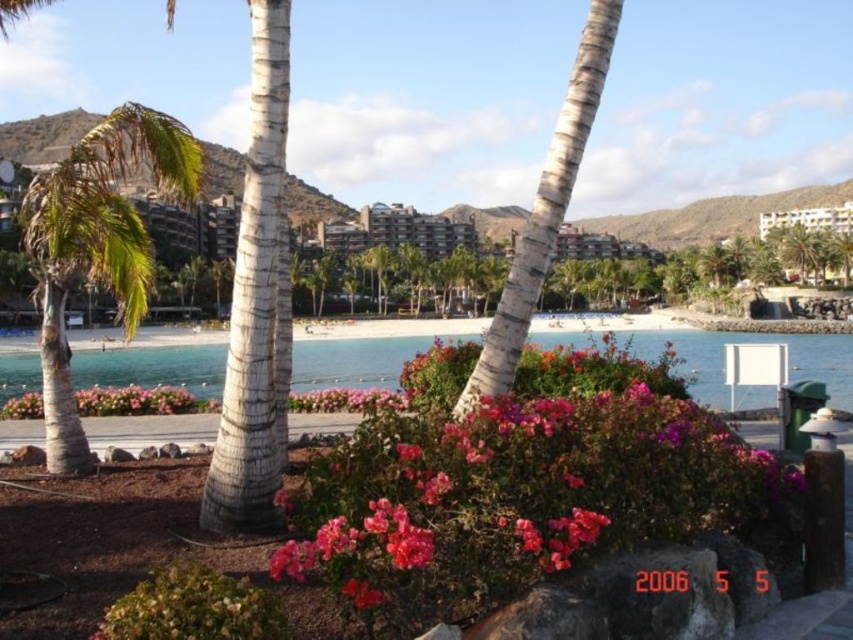
Question: Is white concrete building at upper right in front of pink matte flower at center?

Choices:
 (A) yes
 (B) no

Answer: (B)

Question: Which point is farther to the camera?

Choices:
 (A) (84, 467)
 (B) (355, 358)
 (C) (122, 413)
 (D) (357, 584)

Answer: (B)

Question: Is green leafy palm tree at center thinner than white concrete building at upper right?

Choices:
 (A) no
 (B) yes

Answer: (A)

Question: Is green leafy palm tree at center above pink matte flower at center?

Choices:
 (A) yes
 (B) no

Answer: (A)

Question: Based on their relative distances, which object is nearer to the green leafy palm tree at center?

Choices:
 (A) white concrete building at upper right
 (B) pink matte flowers at lower center
 (C) pink matte flower at center
 (D) pink matte flowers at center

Answer: (B)

Question: Which object is closer to the camera taking this photo?

Choices:
 (A) pink matte flowers at center
 (B) pink matte flowers at lower center

Answer: (A)